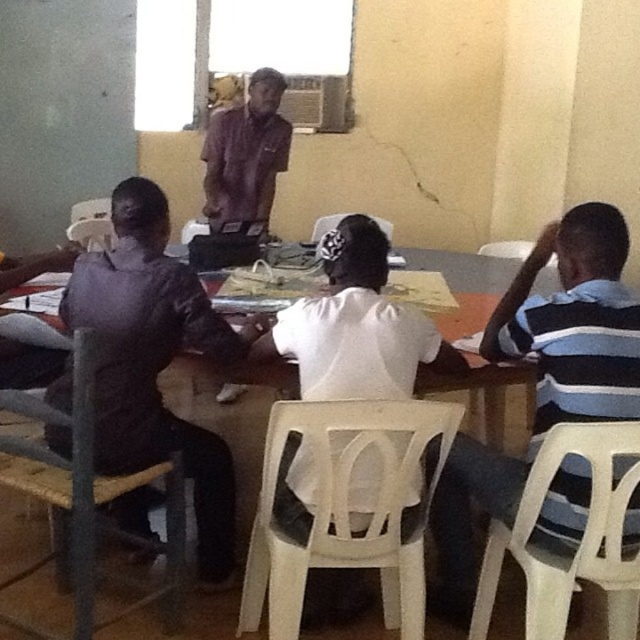
Is blue striped shirt at right wider than brown fabric shirt at center?

Indeed, blue striped shirt at right has a greater width compared to brown fabric shirt at center.

In the scene shown: Who is more distant from viewer, (604, 403) or (225, 173)?

The point (225, 173) is behind.

Where is `blue striped shirt at right`? blue striped shirt at right is located at coordinates (544, 378).

Between matte black shirt at left and brown fabric shirt at center, which one has more height?

matte black shirt at left

Which is in front, point (138, 193) or point (241, 196)?

Point (138, 193) is more forward.

You are a GUI agent. You are given a task and a screenshot of the screen. Output one action in this format:
    pyautogui.click(x=<x>, y=<y>)
    Task: Click on the matte black shirt at left
    The image size is (640, 640).
    Given the screenshot: What is the action you would take?
    pyautogui.click(x=156, y=362)

Find the location of a particular element. The width and height of the screenshot is (640, 640). blue striped shirt at right is located at coordinates (544, 378).

Is the position of blue striped shirt at right less distant than that of matte black shirt at left?

No, it is behind matte black shirt at left.

Which is in front, point (637, 314) or point (116, 344)?

Point (637, 314)

This screenshot has width=640, height=640. Identify the location of blue striped shirt at right. (544, 378).